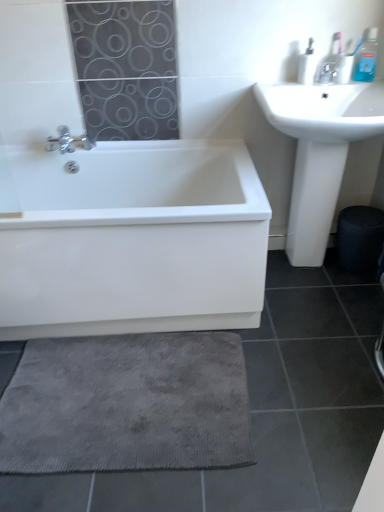
Question: Can you confirm if white plastic soap dispenser at upper right, which ranks as the second toiletry in right-to-left order, is thinner than satin nickel faucet at upper right?

Choices:
 (A) no
 (B) yes

Answer: (B)

Question: Are white plastic soap dispenser at upper right, which ranks as the first toiletry in left-to-right order, and satin nickel faucet at upper right located far from each other?

Choices:
 (A) no
 (B) yes

Answer: (A)

Question: From a real-world perspective, is white plastic soap dispenser at upper right, which ranks as the second toiletry in right-to-left order, located beneath satin nickel faucet at upper right?

Choices:
 (A) no
 (B) yes

Answer: (A)

Question: Does white plastic soap dispenser at upper right, which ranks as the first toiletry in left-to-right order, have a lesser height compared to satin nickel faucet at upper right?

Choices:
 (A) no
 (B) yes

Answer: (A)

Question: From the image's perspective, is white plastic soap dispenser at upper right, which ranks as the second toiletry in right-to-left order, below satin nickel faucet at upper right?

Choices:
 (A) no
 (B) yes

Answer: (A)

Question: Is satin nickel faucet at upper right located within white plastic soap dispenser at upper right, which ranks as the second toiletry in right-to-left order?

Choices:
 (A) yes
 (B) no

Answer: (B)

Question: Does blue plastic toothbrush at upper right, the second toiletry positioned from the left, have a lesser width compared to gray textured bath mat at lower center?

Choices:
 (A) no
 (B) yes

Answer: (B)

Question: Can you confirm if blue plastic toothbrush at upper right, the second toiletry positioned from the left, is positioned to the right of gray textured bath mat at lower center?

Choices:
 (A) yes
 (B) no

Answer: (A)

Question: Is the depth of blue plastic toothbrush at upper right, the first toiletry in the right-to-left sequence, greater than that of gray textured bath mat at lower center?

Choices:
 (A) yes
 (B) no

Answer: (A)

Question: Considering the relative positions of blue plastic toothbrush at upper right, the second toiletry positioned from the left, and gray textured bath mat at lower center in the image provided, is blue plastic toothbrush at upper right, the second toiletry positioned from the left, in front of gray textured bath mat at lower center?

Choices:
 (A) yes
 (B) no

Answer: (B)

Question: From a real-world perspective, is blue plastic toothbrush at upper right, the second toiletry positioned from the left, below gray textured bath mat at lower center?

Choices:
 (A) no
 (B) yes

Answer: (A)

Question: Is blue plastic toothbrush at upper right, the second toiletry positioned from the left, aimed at gray textured bath mat at lower center?

Choices:
 (A) no
 (B) yes

Answer: (A)

Question: Can you confirm if white glossy bathtub at lower left is positioned to the right of gray textured bath mat at lower center?

Choices:
 (A) no
 (B) yes

Answer: (A)